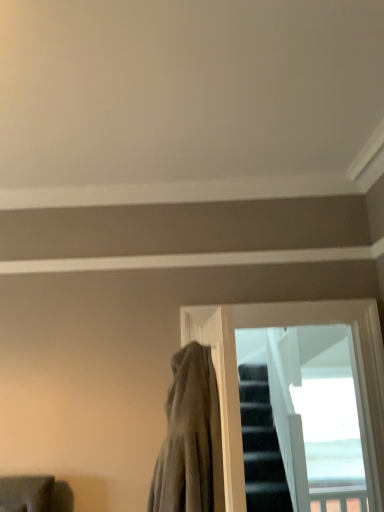
Measure the distance between point (371, 442) and camera.

Point (371, 442) and camera are 2.10 meters apart.

Where is `transparent glass window at center`? transparent glass window at center is located at coordinates (281, 324).

Describe the element at coordinates (281, 324) in the screenshot. I see `transparent glass window at center` at that location.

This screenshot has height=512, width=384. I want to click on gray cotton cloak at center, so click(190, 439).

What do you see at coordinates (190, 439) in the screenshot? I see `gray cotton cloak at center` at bounding box center [190, 439].

Find the location of a particular element. transparent glass window at center is located at coordinates (281, 324).

Is gray cotton cloak at center to the left or to the right of transparent glass window at center in the image?

Clearly, gray cotton cloak at center is on the left of transparent glass window at center in the image.

Which object is further away from the camera, gray cotton cloak at center or transparent glass window at center?

transparent glass window at center is further away from the camera.

Is point (187, 451) positioned in front of point (186, 331)?

Yes, it is.

From the image's perspective, is gray cotton cloak at center located above or below transparent glass window at center?

Clearly, from the image's perspective, gray cotton cloak at center is above transparent glass window at center.

From a real-world perspective, is gray cotton cloak at center located beneath transparent glass window at center?

Yes, from a real-world perspective, gray cotton cloak at center is beneath transparent glass window at center.

Considering the sizes of objects gray cotton cloak at center and transparent glass window at center in the image provided, who is thinner, gray cotton cloak at center or transparent glass window at center?

With smaller width is transparent glass window at center.

In terms of height, does gray cotton cloak at center look taller or shorter compared to transparent glass window at center?

Clearly, gray cotton cloak at center is shorter compared to transparent glass window at center.

Which of these two, gray cotton cloak at center or transparent glass window at center, is smaller?

With smaller size is transparent glass window at center.

Is transparent glass window at center located within gray cotton cloak at center?

Actually, transparent glass window at center is outside gray cotton cloak at center.

Is gray cotton cloak at center with transparent glass window at center?

There is a gap between gray cotton cloak at center and transparent glass window at center.

Is gray cotton cloak at center oriented away from transparent glass window at center?

Yes.

What's the angular difference between gray cotton cloak at center and transparent glass window at center's facing directions?

They differ by 85.1 degrees in their facing directions.

You are a GUI agent. You are given a task and a screenshot of the screen. Output one action in this format:
    pyautogui.click(x=<x>, y=<y>)
    Task: Click on the window above the gray cotton cloak at center (from a real-world perspective)
    
    Given the screenshot: What is the action you would take?
    pyautogui.click(x=281, y=324)

Does transparent glass window at center appear on the right side of gray cotton cloak at center?

Indeed, transparent glass window at center is positioned on the right side of gray cotton cloak at center.

Which object is further away from the camera taking this photo, transparent glass window at center or gray cotton cloak at center?

transparent glass window at center is more distant.

Which is further, (267,319) or (174,460)?

Point (267,319)

From the image's perspective, is transparent glass window at center beneath gray cotton cloak at center?

Yes.

From a real-world perspective, is transparent glass window at center over gray cotton cloak at center?

Correct, in the physical world, transparent glass window at center is higher than gray cotton cloak at center.

Considering the relative sizes of transparent glass window at center and gray cotton cloak at center in the image provided, is transparent glass window at center wider than gray cotton cloak at center?

Incorrect, the width of transparent glass window at center does not surpass that of gray cotton cloak at center.

In the scene shown: Can you confirm if transparent glass window at center is taller than gray cotton cloak at center?

Correct, transparent glass window at center is much taller as gray cotton cloak at center.

In terms of size, does transparent glass window at center appear bigger or smaller than gray cotton cloak at center?

Clearly, transparent glass window at center is smaller in size than gray cotton cloak at center.

Is transparent glass window at center not within gray cotton cloak at center?

transparent glass window at center lies outside gray cotton cloak at center's area.

Is transparent glass window at center positioned far away from gray cotton cloak at center?

transparent glass window at center is actually quite close to gray cotton cloak at center.

Is transparent glass window at center aimed at gray cotton cloak at center?

No, transparent glass window at center is not oriented towards gray cotton cloak at center.

Measure the distance between transparent glass window at center and gray cotton cloak at center.

transparent glass window at center and gray cotton cloak at center are 27.22 inches apart.

Identify the location of cloak that is in front of the transparent glass window at center. The height and width of the screenshot is (512, 384). (190, 439).

This screenshot has width=384, height=512. I want to click on cloak below the transparent glass window at center (from a real-world perspective), so click(x=190, y=439).

In order to click on cloak located above the transparent glass window at center (from the image's perspective) in this screenshot , I will do `click(190, 439)`.